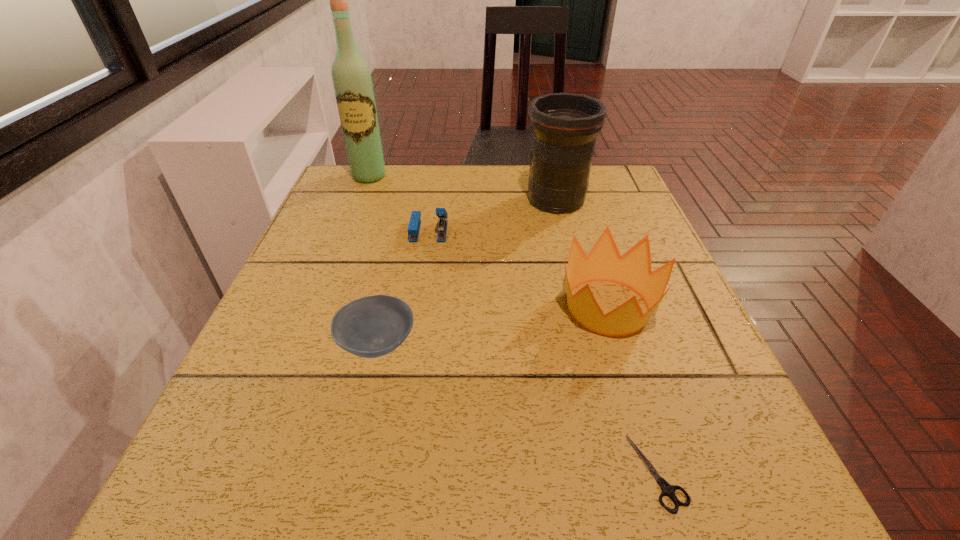
The height and width of the screenshot is (540, 960). What are the coordinates of `vacant region at the far left corner of the desktop` in the screenshot? It's located at (366, 199).

Identify the location of vacant space at the far right corner of the desktop. The width and height of the screenshot is (960, 540). (611, 184).

The height and width of the screenshot is (540, 960). In order to click on vacant area at the near right corner in this screenshot , I will do `click(714, 488)`.

Locate an element on the screen. empty space that is in between the fifth shortest object and the tallest object is located at coordinates (463, 188).

Find the location of a particular element. The image size is (960, 540). free area in between the leftmost object and the fifth tallest object is located at coordinates (373, 260).

Where is `vacant space that is in between the stapler and the third tallest object`? vacant space that is in between the stapler and the third tallest object is located at coordinates (518, 269).

You are a GUI agent. You are given a task and a screenshot of the screen. Output one action in this format:
    pyautogui.click(x=<x>, y=<y>)
    Task: Click on the empty space that is in between the stapler and the telephoto lens
    Image resolution: width=960 pixels, height=540 pixels.
    Given the screenshot: What is the action you would take?
    pyautogui.click(x=492, y=215)

Locate an element on the screen. This screenshot has width=960, height=540. vacant area that lies between the second tallest object and the bowl is located at coordinates (467, 272).

This screenshot has height=540, width=960. What are the coordinates of `free space that is in between the shortest object and the third tallest object` in the screenshot? It's located at (633, 389).

Where is `free spot between the wine bottle and the shears`? free spot between the wine bottle and the shears is located at coordinates (514, 324).